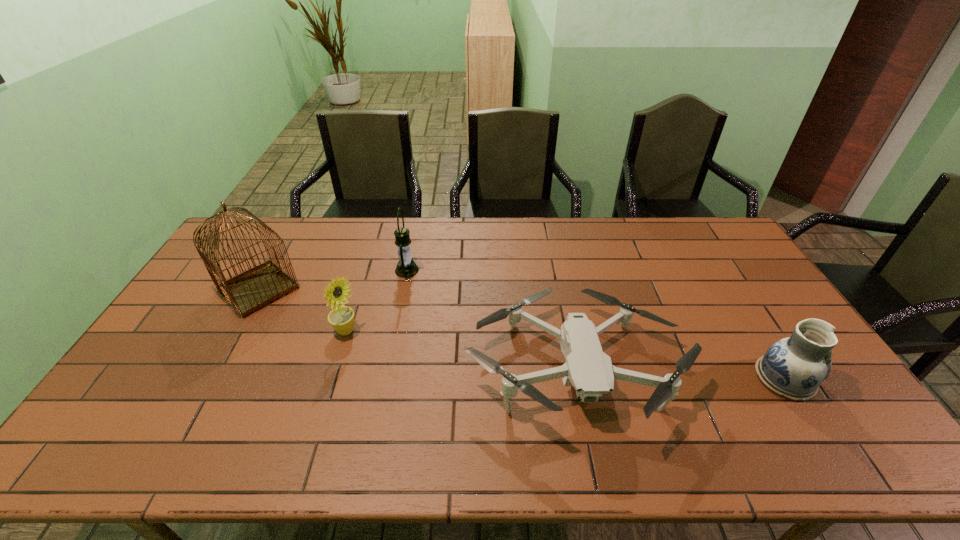
Locate an element on the screen. free area in between the sunflower and the second tallest object is located at coordinates (376, 301).

This screenshot has height=540, width=960. What are the coordinates of `free point between the drone and the second object from left to right` in the screenshot? It's located at (459, 349).

This screenshot has height=540, width=960. What are the coordinates of `object that ranks as the third closest to the birdcage` in the screenshot? It's located at (588, 369).

Where is `the closest object relative to the lantern`? the closest object relative to the lantern is located at coordinates (341, 318).

Where is `vacant region that satisfies the following two spatial constraints: 1. with a camera at the front of the shortest object; 2. on the left side of the pottery`? This screenshot has height=540, width=960. vacant region that satisfies the following two spatial constraints: 1. with a camera at the front of the shortest object; 2. on the left side of the pottery is located at coordinates (574, 379).

Identify the location of vacant area in the image that satisfies the following two spatial constraints: 1. on the back side of the pottery; 2. on the face of the fourth object from right to left. This screenshot has height=540, width=960. (756, 332).

This screenshot has width=960, height=540. I want to click on free space in the image that satisfies the following two spatial constraints: 1. on the front side of the rightmost object; 2. on the left side of the leftmost object, so click(x=209, y=379).

You are a GUI agent. You are given a task and a screenshot of the screen. Output one action in this format:
    pyautogui.click(x=<x>, y=<y>)
    Task: Click on the vacant space that satisfies the following two spatial constraints: 1. on the side where the lantern emits light; 2. on the front side of the birdcage
    This screenshot has height=540, width=960.
    Given the screenshot: What is the action you would take?
    pyautogui.click(x=403, y=289)

The image size is (960, 540). I want to click on free space that satisfies the following two spatial constraints: 1. on the face of the rightmost object; 2. on the left side of the sunflower, so click(331, 379).